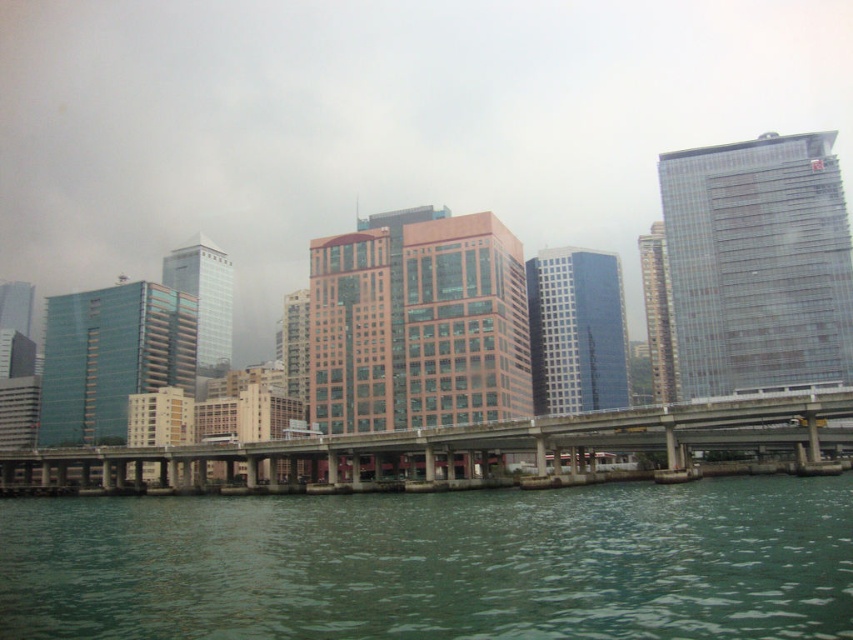
You are a photographer planning to capture the matte orange building at center and the concrete bridge at center in a single shot. Based on their positions, which object should you focus on first to ensure both are in frame?

The concrete bridge at center is located below the matte orange building at center, so you should focus on the matte orange building at center first to ensure both are in frame.